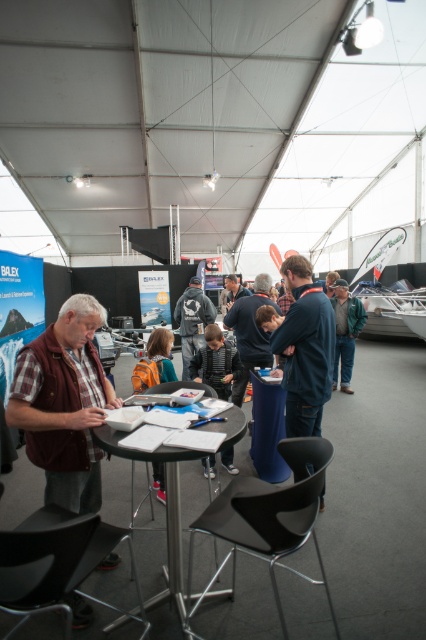
Does dark blue jeans at center have a smaller size compared to green leather jacket at center?

Yes, dark blue jeans at center is smaller than green leather jacket at center.

How distant is dark blue jeans at center from green leather jacket at center?

dark blue jeans at center and green leather jacket at center are 6.13 feet apart.

Which is in front, point (244, 387) or point (345, 385)?

Point (244, 387) is more forward.

You are a GUI agent. You are given a task and a screenshot of the screen. Output one action in this format:
    pyautogui.click(x=<x>, y=<y>)
    Task: Click on the dark blue jeans at center
    
    Given the screenshot: What is the action you would take?
    pyautogui.click(x=250, y=333)

Can you confirm if dark blue jeans at center is wider than dark gray fabric jacket at center?

Incorrect, dark blue jeans at center's width does not surpass dark gray fabric jacket at center's.

Find the location of `dark blue jeans at center`. dark blue jeans at center is located at coordinates click(x=250, y=333).

Identify the location of dark blue jeans at center. (250, 333).

Does black metal table at center have a greater width compared to dark blue jeans at center?

Indeed, black metal table at center has a greater width compared to dark blue jeans at center.

Is black metal table at center in front of dark blue jeans at center?

Yes, it is in front of dark blue jeans at center.

Is point (219, 424) in front of point (250, 340)?

Yes, it is in front of point (250, 340).

Image resolution: width=426 pixels, height=640 pixels. What are the coordinates of `black metal table at center` in the screenshot? It's located at (166, 509).